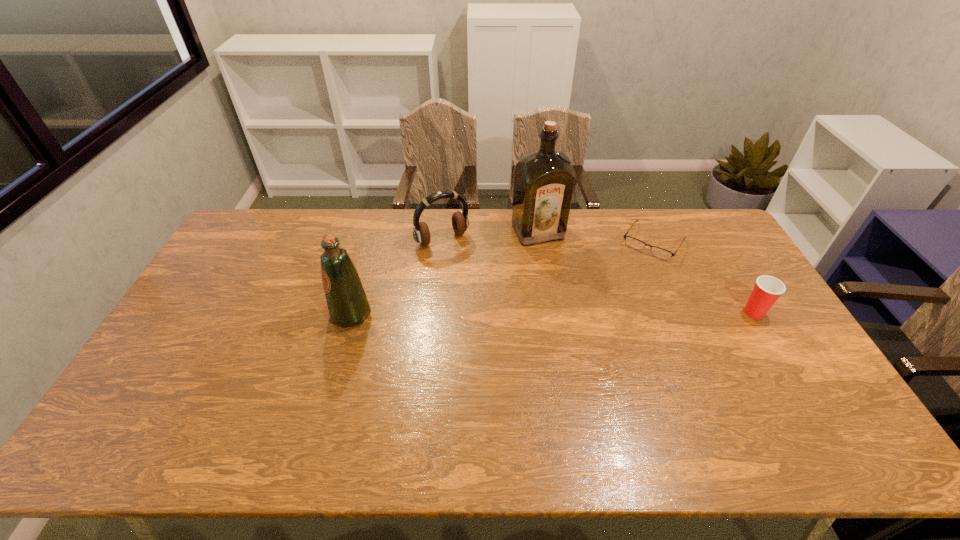
In the image, there is a desktop. In order to click on blank space at the near edge in this screenshot , I will do `click(324, 404)`.

Image resolution: width=960 pixels, height=540 pixels. Identify the location of vacant space at the left edge. (x=161, y=374).

Image resolution: width=960 pixels, height=540 pixels. In the image, there is a desktop. Identify the location of vacant space at the right edge. (720, 306).

Find the location of a particular element. free spot between the fourth object from left to right and the third object from left to right is located at coordinates (596, 237).

Where is `vacant area that lies between the rightmost object and the shortest object`? The height and width of the screenshot is (540, 960). vacant area that lies between the rightmost object and the shortest object is located at coordinates (704, 277).

Identify the location of free space between the fourth shortest object and the shortest object. (502, 278).

At what (x,y) coordinates should I click in order to perform the action: click on vacant space that's between the Dixie cup and the tallest object. Please return your answer as a coordinate pair (x, y). The width and height of the screenshot is (960, 540). Looking at the image, I should click on pos(646,272).

At what (x,y) coordinates should I click in order to perform the action: click on vacant space that's between the second tallest object and the shortest object. Please return your answer as a coordinate pair (x, y). The height and width of the screenshot is (540, 960). Looking at the image, I should click on (502, 278).

Identify the location of free space that is in between the shortest object and the Dixie cup. The height and width of the screenshot is (540, 960). (704, 277).

Where is `free area in between the fourth shortest object and the liquor`? This screenshot has width=960, height=540. free area in between the fourth shortest object and the liquor is located at coordinates (444, 273).